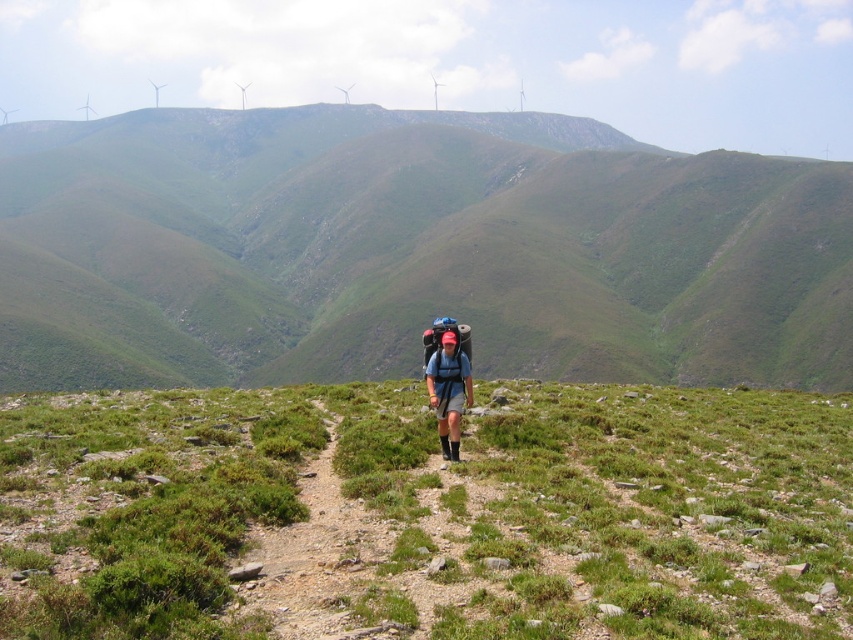
Can you confirm if green grassy hill at center is wider than dirt/gravel path at center?

Indeed, green grassy hill at center has a greater width compared to dirt/gravel path at center.

Who is taller, green grassy hill at center or dirt/gravel path at center?

With more height is green grassy hill at center.

The image size is (853, 640). What do you see at coordinates (410, 250) in the screenshot?
I see `green grassy hill at center` at bounding box center [410, 250].

At what (x,y) coordinates should I click in order to perform the action: click on green grassy hill at center. Please return your answer as a coordinate pair (x, y). The width and height of the screenshot is (853, 640). Looking at the image, I should click on (410, 250).

Is point (310, 483) less distant than point (450, 428)?

That is True.

Looking at this image, who is taller, dirt/gravel path at center or matte blue backpack at center?

matte blue backpack at center is taller.

The width and height of the screenshot is (853, 640). Find the location of `dirt/gravel path at center`. dirt/gravel path at center is located at coordinates (321, 556).

The image size is (853, 640). What are the coordinates of `dirt/gravel path at center` in the screenshot? It's located at (321, 556).

Who is taller, green grassy hill at center or green grassy at center?

Standing taller between the two is green grassy hill at center.

Looking at this image, which is above, green grassy hill at center or green grassy at center?

green grassy hill at center is higher up.

Who is more distant from viewer, (787, 276) or (479, 600)?

The point (787, 276) is more distant.

Locate an element on the screen. This screenshot has height=640, width=853. green grassy hill at center is located at coordinates (410, 250).